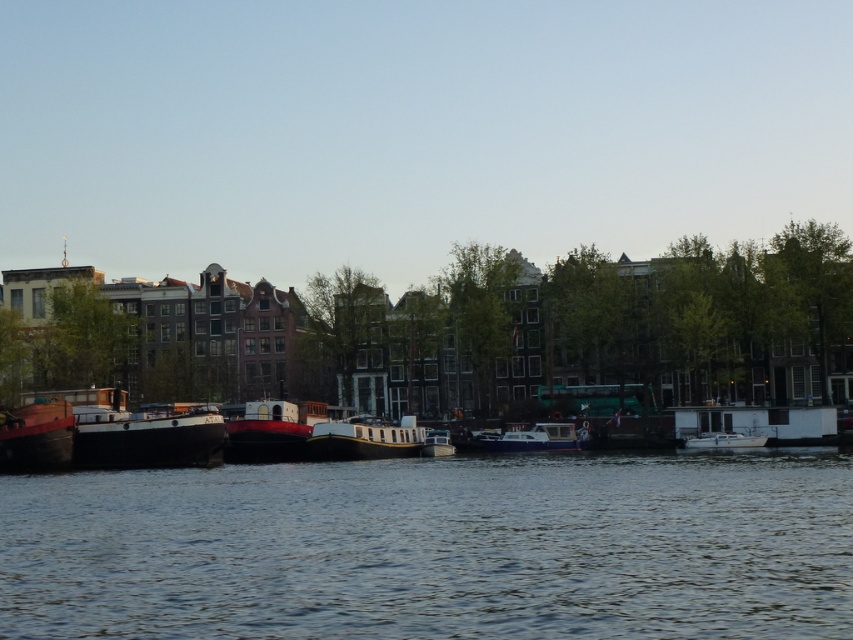
Is smooth water at center thinner than matte red boat at left?

In fact, smooth water at center might be wider than matte red boat at left.

Can you confirm if smooth water at center is shorter than matte red boat at left?

No.

Is point (49, 504) farther from viewer compared to point (57, 403)?

No, it is not.

What are the coordinates of `smooth water at center` in the screenshot? It's located at point(434,548).

Describe the element at coordinates (434, 548) in the screenshot. I see `smooth water at center` at that location.

Who is lower down, smooth water at center or white matte boat at center?

smooth water at center is below.

Image resolution: width=853 pixels, height=640 pixels. Identify the location of smooth water at center. (434, 548).

This screenshot has height=640, width=853. What are the coordinates of `smooth water at center` in the screenshot? It's located at (434, 548).

At what (x,y) coordinates should I click in order to perform the action: click on white glossy boat at center. Please return your answer as a coordinate pair (x, y). The height and width of the screenshot is (640, 853). Looking at the image, I should click on (535, 438).

Locate an element on the screen. white glossy boat at center is located at coordinates (535, 438).

Locate an element on the screen. white glossy boat at center is located at coordinates (535, 438).